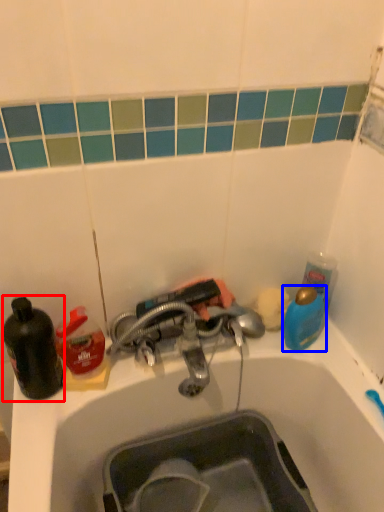
Question: Which point is further to the camera, bottle (highlighted by a red box) or teal (highlighted by a blue box)?

Choices:
 (A) bottle
 (B) teal

Answer: (B)